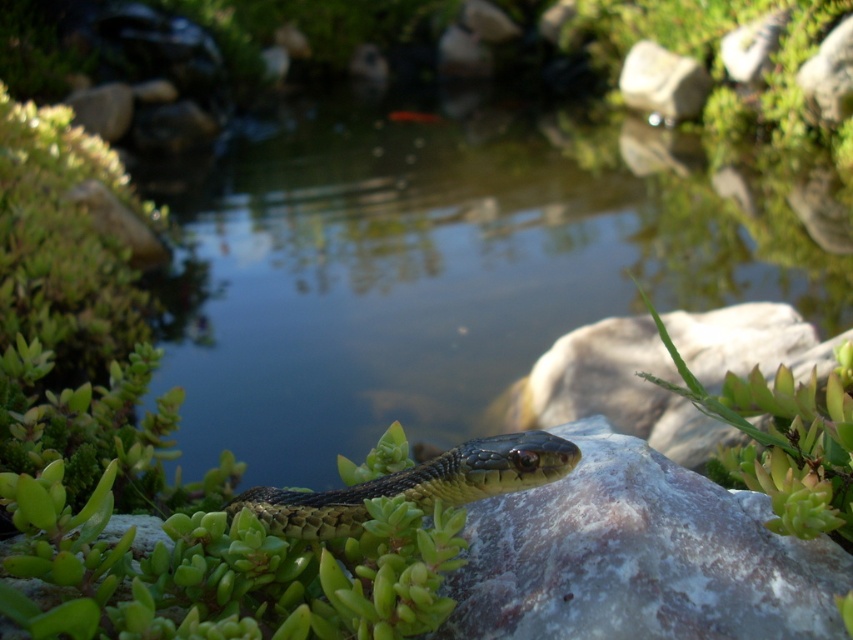
Which of these two, clear water at center or white smooth rock at upper center, stands taller?

clear water at center

Consider the image. Who is more distant from viewer, (639, 211) or (633, 52)?

The point (633, 52) is more distant.

I want to click on clear water at center, so click(450, 260).

Is white marble rock at center to the right of green scaly snake at center from the viewer's perspective?

Indeed, white marble rock at center is positioned on the right side of green scaly snake at center.

Which is behind, point (821, 612) or point (274, 492)?

Positioned behind is point (274, 492).

Between point (728, 582) and point (422, 476), which one is positioned in front?

Point (728, 582) is in front.

The image size is (853, 640). Identify the location of white marble rock at center. (637, 557).

Looking at this image, is clear water at center above green succulent at upper right?

Correct, clear water at center is located above green succulent at upper right.

Can you confirm if clear water at center is bigger than green succulent at upper right?

Yes, clear water at center is bigger than green succulent at upper right.

Where is `clear water at center`? Image resolution: width=853 pixels, height=640 pixels. clear water at center is located at coordinates (450, 260).

At what (x,y) coordinates should I click in order to perform the action: click on clear water at center. Please return your answer as a coordinate pair (x, y). Looking at the image, I should click on (450, 260).